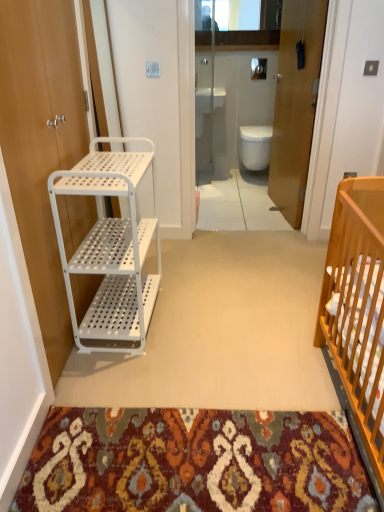
Question: From the image's perspective, is white glossy sink at upper center located beneath white matte door at left, the 1th door positioned from the left?

Choices:
 (A) yes
 (B) no

Answer: (B)

Question: Is white matte door at left, the 2th door from the right, surrounded by white glossy sink at upper center?

Choices:
 (A) yes
 (B) no

Answer: (B)

Question: Is white glossy sink at upper center facing away from white matte door at left, the 2th door from the right?

Choices:
 (A) yes
 (B) no

Answer: (B)

Question: Is white glossy sink at upper center placed right next to white matte door at left, the 1th door positioned from the left?

Choices:
 (A) yes
 (B) no

Answer: (B)

Question: From a real-world perspective, is white glossy sink at upper center located higher than white matte door at left, acting as the 1th door starting from the front?

Choices:
 (A) yes
 (B) no

Answer: (B)

Question: Is transparent glass door at center in front of or behind wooden door at center, which appears as the 1th door when viewed from the back, in the image?

Choices:
 (A) front
 (B) behind

Answer: (A)

Question: Considering the relative positions of transparent glass door at center and wooden door at center, the 1th door viewed from the right, in the image provided, is transparent glass door at center to the left or to the right of wooden door at center, the 1th door viewed from the right,?

Choices:
 (A) right
 (B) left

Answer: (B)

Question: In terms of size, does transparent glass door at center appear bigger or smaller than wooden door at center, which appears as the 1th door when viewed from the back?

Choices:
 (A) small
 (B) big

Answer: (B)

Question: From a real-world perspective, is transparent glass door at center positioned above or below wooden door at center, which appears as the 1th door when viewed from the back?

Choices:
 (A) below
 (B) above

Answer: (A)

Question: In the image, is white glossy toilet at center on the left side or the right side of white matte door at left, the second door from the back?

Choices:
 (A) left
 (B) right

Answer: (B)

Question: From a real-world perspective, is white glossy toilet at center physically located above or below white matte door at left, the 1th door positioned from the left?

Choices:
 (A) below
 (B) above

Answer: (A)

Question: Is point (248, 165) positioned closer to the camera than point (26, 259)?

Choices:
 (A) farther
 (B) closer

Answer: (A)

Question: Is white glossy toilet at center inside the boundaries of white matte door at left, acting as the 1th door starting from the front, or outside?

Choices:
 (A) inside
 (B) outside

Answer: (B)

Question: Choose the correct answer: Is white glossy sink at upper center inside transparent glass door at center or outside it?

Choices:
 (A) outside
 (B) inside

Answer: (A)

Question: From a real-world perspective, relative to transparent glass door at center, is white glossy sink at upper center vertically above or below?

Choices:
 (A) above
 (B) below

Answer: (B)